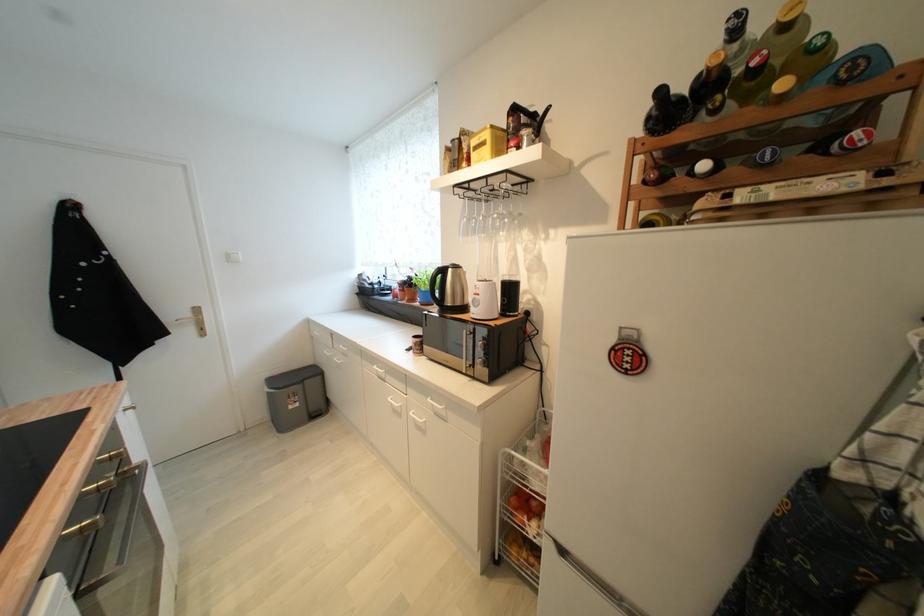
Describe the element at coordinates (96, 543) in the screenshot. I see `the oven door handle` at that location.